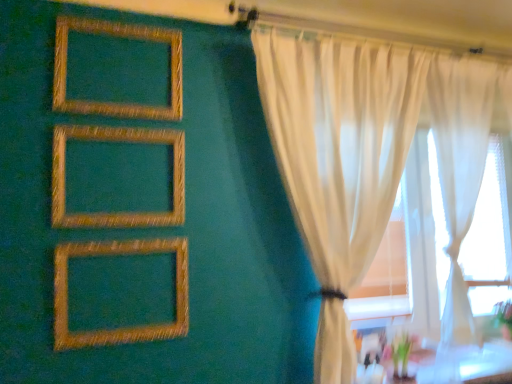
Question: Is gold textured frame at upper left, the 1th picture frame viewed from the top, not within sheer white curtains at right?

Choices:
 (A) yes
 (B) no

Answer: (A)

Question: Is gold textured frame at upper left, acting as the 3th picture frame starting from the bottom, thinner than sheer white curtains at right?

Choices:
 (A) no
 (B) yes

Answer: (B)

Question: Does gold textured frame at upper left, the 1th picture frame viewed from the top, have a larger size compared to sheer white curtains at right?

Choices:
 (A) no
 (B) yes

Answer: (A)

Question: Is gold textured frame at upper left, the 1th picture frame viewed from the top, in front of sheer white curtains at right?

Choices:
 (A) no
 (B) yes

Answer: (B)

Question: From the image's perspective, does gold textured frame at upper left, acting as the 3th picture frame starting from the bottom, appear higher than sheer white curtains at right?

Choices:
 (A) no
 (B) yes

Answer: (B)

Question: Considering the relative sizes of gold textured frame at upper left, acting as the 3th picture frame starting from the bottom, and sheer white curtains at right in the image provided, is gold textured frame at upper left, acting as the 3th picture frame starting from the bottom, taller than sheer white curtains at right?

Choices:
 (A) yes
 (B) no

Answer: (B)

Question: From the image's perspective, would you say white sheer curtain at right is positioned over gold textured frame at center, placed as the second picture frame when sorted from top to bottom?

Choices:
 (A) no
 (B) yes

Answer: (A)

Question: From the image's perspective, is white sheer curtain at right under gold textured frame at center, placed as the second picture frame when sorted from top to bottom?

Choices:
 (A) yes
 (B) no

Answer: (A)

Question: Is white sheer curtain at right turned away from gold textured frame at center, which ranks as the second picture frame in bottom-to-top order?

Choices:
 (A) yes
 (B) no

Answer: (B)

Question: Does white sheer curtain at right appear on the left side of gold textured frame at center, which ranks as the second picture frame in bottom-to-top order?

Choices:
 (A) yes
 (B) no

Answer: (B)

Question: From a real-world perspective, is white sheer curtain at right positioned over gold textured frame at center, placed as the second picture frame when sorted from top to bottom, based on gravity?

Choices:
 (A) no
 (B) yes

Answer: (A)

Question: Can you confirm if white sheer curtain at right is thinner than gold textured frame at center, placed as the second picture frame when sorted from top to bottom?

Choices:
 (A) no
 (B) yes

Answer: (A)

Question: Is gold textured picture frame at lower left, placed as the first picture frame when sorted from bottom to top, to the left of gold textured frame at center, placed as the second picture frame when sorted from top to bottom, from the viewer's perspective?

Choices:
 (A) no
 (B) yes

Answer: (A)